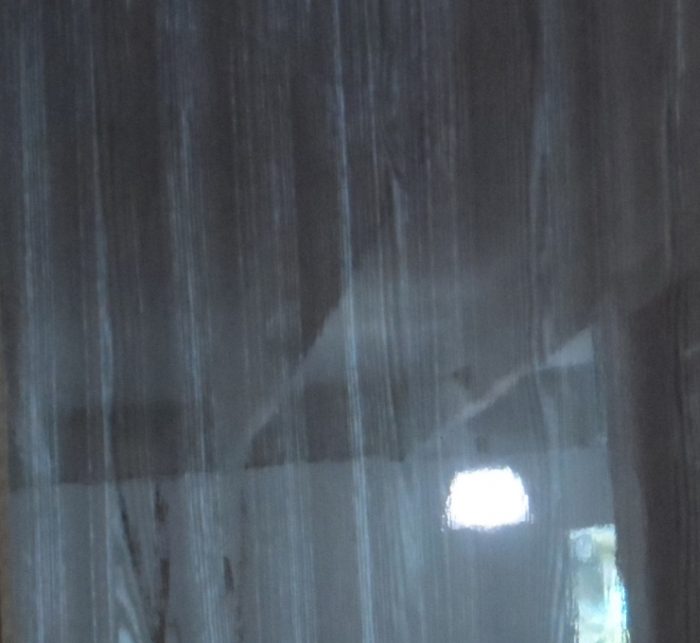
Where is `wall`? The image size is (700, 643). wall is located at coordinates (638, 368), (659, 426), (666, 509).